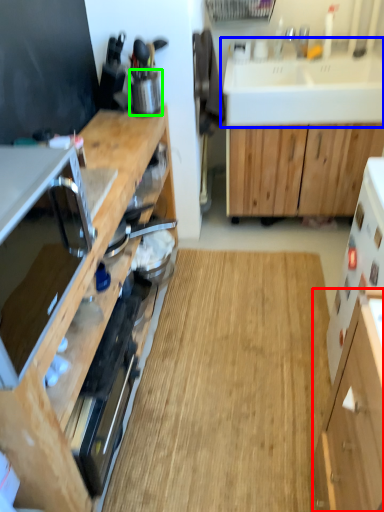
Question: Based on their relative distances, which object is nearer to cabinetry (highlighted by a red box)? Choose from sink (highlighted by a blue box) and appliance (highlighted by a green box).

Choices:
 (A) sink
 (B) appliance

Answer: (B)